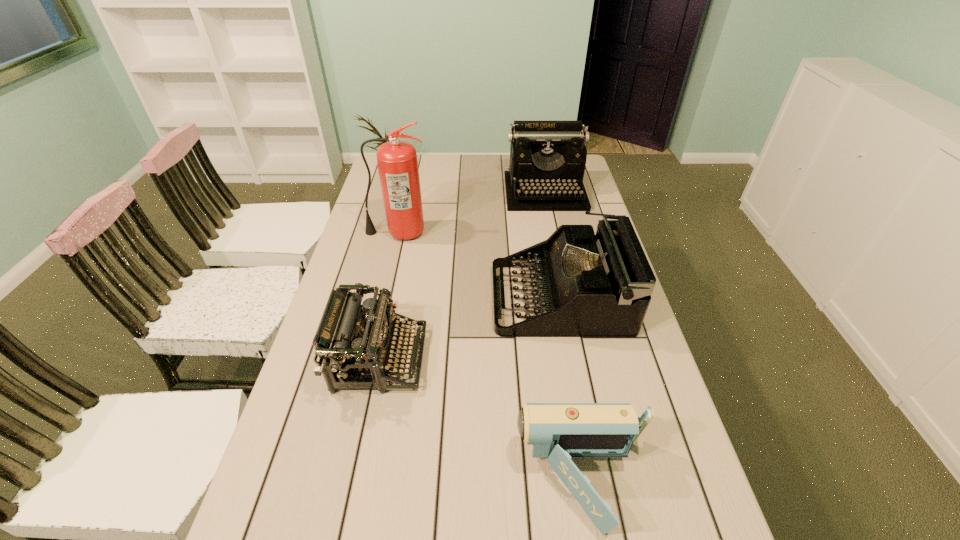
Locate an element on the screen. The image size is (960, 540). the fourth nearest object is located at coordinates (397, 161).

Locate an element on the screen. The width and height of the screenshot is (960, 540). fire extinguisher is located at coordinates [x=397, y=161].

What are the coordinates of `the farthest object` in the screenshot? It's located at (547, 158).

Where is `the tallest typewriter`? This screenshot has height=540, width=960. the tallest typewriter is located at coordinates (547, 158).

The width and height of the screenshot is (960, 540). In order to click on the leftmost typewriter in this screenshot , I will do `click(349, 344)`.

The height and width of the screenshot is (540, 960). Find the location of `free space located on the instruction side of the fire extinguisher`. free space located on the instruction side of the fire extinguisher is located at coordinates (381, 303).

You are a GUI agent. You are given a task and a screenshot of the screen. Output one action in this format:
    pyautogui.click(x=<x>, y=<y>)
    Task: Click on the free location located 0.160m on the typing side of the farthest typewriter
    
    Given the screenshot: What is the action you would take?
    pyautogui.click(x=554, y=237)

At what (x,y) coordinates should I click in order to perform the action: click on vacant space located 0.150m on the typing side of the shortest typewriter. Please return your answer as a coordinate pair (x, y). Looking at the image, I should click on (481, 359).

Locate an element on the screen. This screenshot has height=540, width=960. object present at the far edge is located at coordinates (547, 158).

Locate an element on the screen. The width and height of the screenshot is (960, 540). fire extinguisher that is at the left edge is located at coordinates (397, 161).